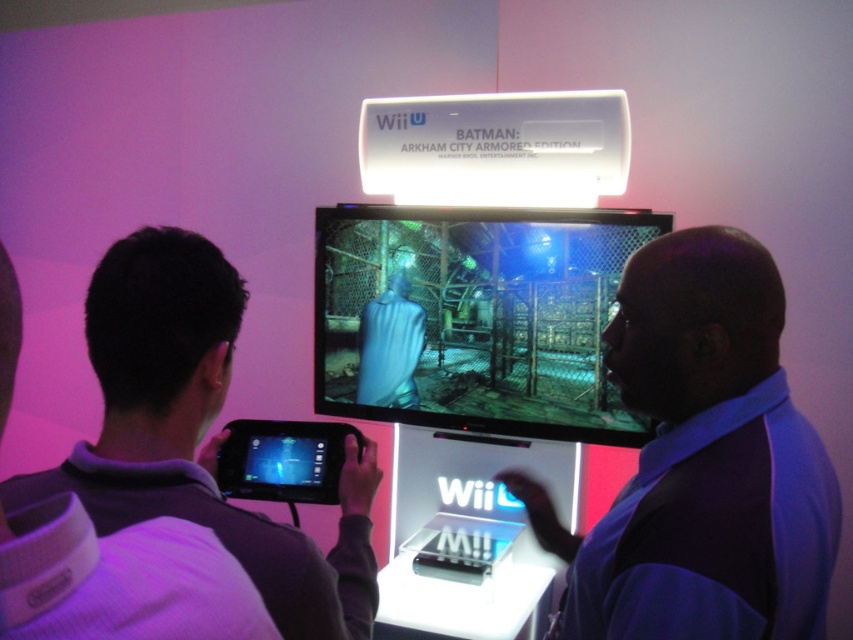
Question: Is purple fabric shirt at upper left to the left of black plastic handheld device at lower center from the viewer's perspective?

Choices:
 (A) yes
 (B) no

Answer: (A)

Question: Which object appears closest to the camera in this image?

Choices:
 (A) blue fabric shirt at right
 (B) black plastic handheld device at lower center
 (C) purple fabric shirt at upper left

Answer: (C)

Question: Is matte black monitor at center to the left of purple fabric shirt at upper left from the viewer's perspective?

Choices:
 (A) yes
 (B) no

Answer: (B)

Question: Which of the following is the closest to the observer?

Choices:
 (A) (160, 420)
 (B) (508, 387)

Answer: (A)

Question: Is blue fabric shirt at right bigger than purple fabric shirt at upper left?

Choices:
 (A) no
 (B) yes

Answer: (A)

Question: Which point appears closest to the camera in this image?

Choices:
 (A) (488, 276)
 (B) (827, 477)

Answer: (B)